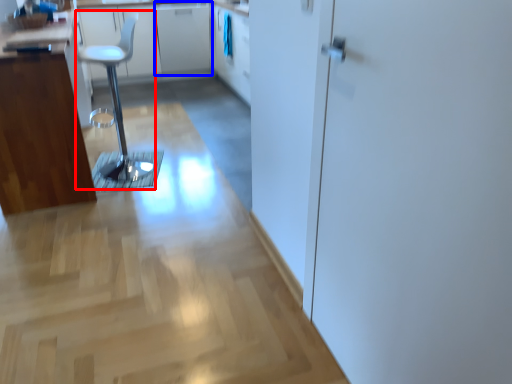
Question: Which object appears closest to the camera in this image, step stool (highlighted by a red box) or cabinetry (highlighted by a blue box)?

Choices:
 (A) step stool
 (B) cabinetry

Answer: (A)